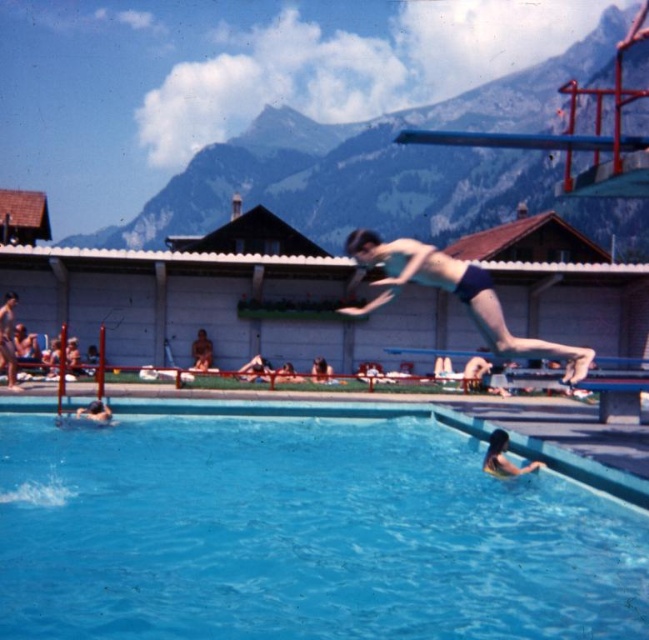
You are standing at the diving board and want to reach the building behind the pool. You can only walk along the poolside. Which direction should you head towards, towards point (x=500, y=436) or point (x=199, y=353)?

You should head towards point (x=199, y=353) because point (x=500, y=436) is in front of point (x=199, y=353), meaning point (x=199, y=353) is behind and closer to the building.

You are a guest at the pool and want to swim towards the blue smooth water at center from the smooth skin person at lower left. Which direction should you swim?

You should swim to the right because the blue smooth water at center is located to the right of the smooth skin person at lower left.

You are a photographer standing at the edge of the pool. You want to take a photo that includes both the blue smooth water at center and the smooth skin person at lower right. Which object will occupy more space in the photo?

The blue smooth water at center will occupy more space in the photo because it is bigger than the smooth skin person at lower right.